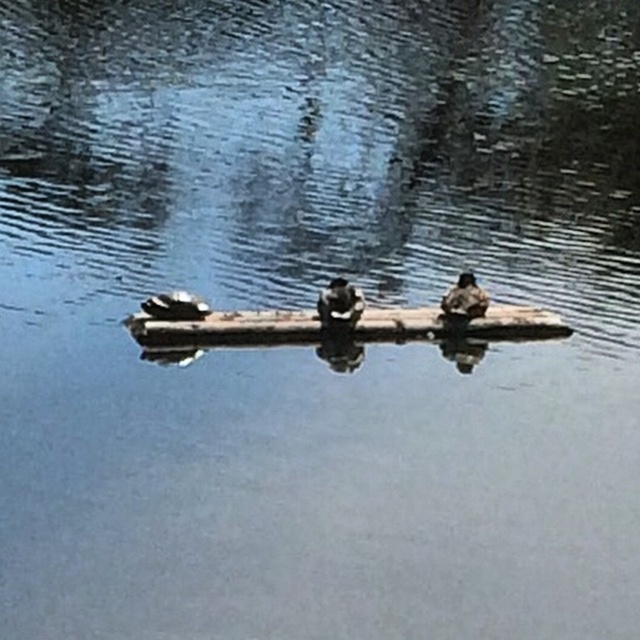
Does brown matte duck at center have a lesser width compared to dark brown feathers at center?

Yes.

Who is more forward, (330,289) or (156,301)?

Point (156,301) is more forward.

Locate an element on the screen. This screenshot has width=640, height=640. brown matte duck at center is located at coordinates (339, 304).